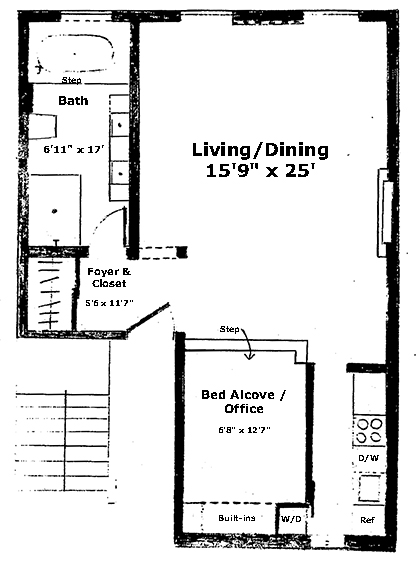
Where is `tub`? The width and height of the screenshot is (420, 562). tub is located at coordinates (88, 49).